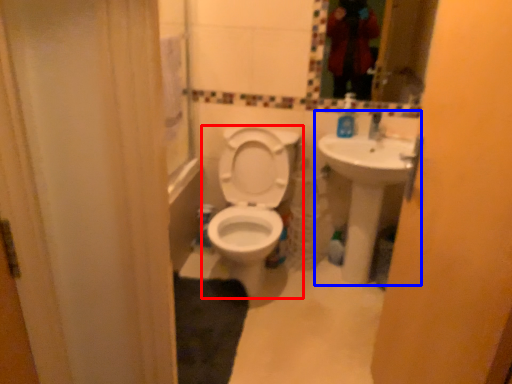
Question: Which object appears closest to the camera in this image, toilet (highlighted by a red box) or sink (highlighted by a blue box)?

Choices:
 (A) toilet
 (B) sink

Answer: (A)